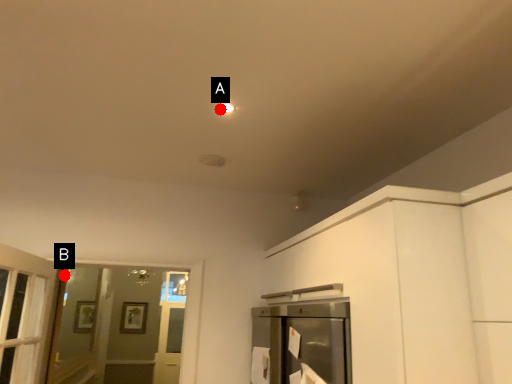
Question: Two points are circled on the image, labeled by A and B beside each circle. Among these points, which one is farthest from the camera?

Choices:
 (A) A is further
 (B) B is further

Answer: (B)